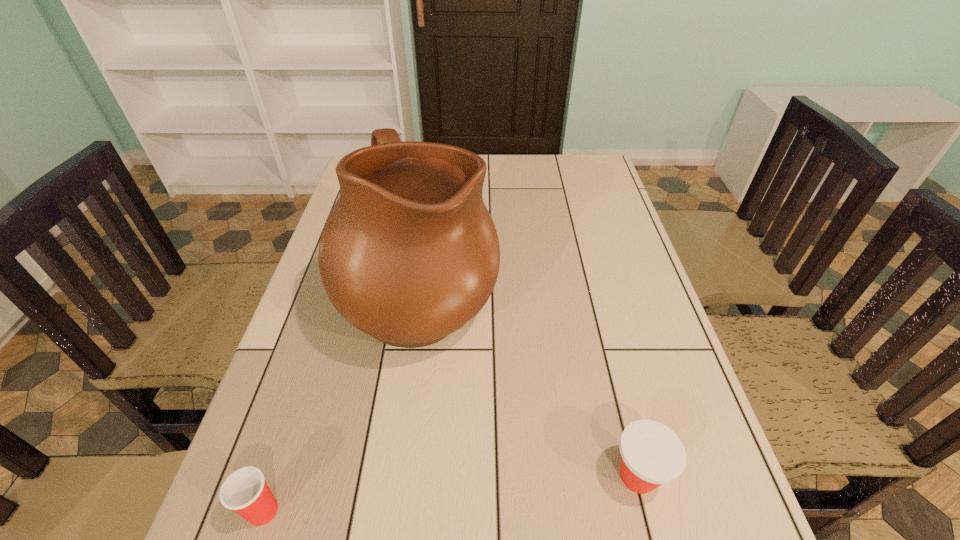
The width and height of the screenshot is (960, 540). Find the location of `vacant space at the left edge of the desktop`. vacant space at the left edge of the desktop is located at coordinates (277, 434).

Locate an element on the screen. vacant space at the right edge of the desktop is located at coordinates (609, 300).

At what (x,y) coordinates should I click in order to perform the action: click on free spot between the cream pitcher and the right Dixie cup. Please return your answer as a coordinate pair (x, y). Looking at the image, I should click on (530, 386).

This screenshot has width=960, height=540. What are the coordinates of `vacant area between the farthest object and the rightmost object` in the screenshot? It's located at (530, 386).

This screenshot has width=960, height=540. In order to click on vacant area between the right Dixie cup and the left Dixie cup in this screenshot , I will do `click(450, 494)`.

Locate which object ranks in proximity to the tallest object. Please provide its 2D coordinates. Your answer should be formatted as a tuple, i.e. [(x, y)], where the tuple contains the x and y coordinates of a point satisfying the conditions above.

[(245, 491)]

Image resolution: width=960 pixels, height=540 pixels. I want to click on object that is the nearest to the rightmost object, so click(x=409, y=254).

Find the location of a particular element. Image resolution: width=960 pixels, height=540 pixels. vacant point that satisfies the following two spatial constraints: 1. at the spout of the farthest object; 2. on the front side of the left Dixie cup is located at coordinates (394, 511).

Find the location of a particular element. The width and height of the screenshot is (960, 540). free space in the image that satisfies the following two spatial constraints: 1. on the back side of the left Dixie cup; 2. on the right side of the rightmost object is located at coordinates (275, 476).

Where is `vacant region that satisfies the following two spatial constraints: 1. on the back side of the right Dixie cup; 2. on the right side of the left Dixie cup`? The image size is (960, 540). vacant region that satisfies the following two spatial constraints: 1. on the back side of the right Dixie cup; 2. on the right side of the left Dixie cup is located at coordinates (275, 476).